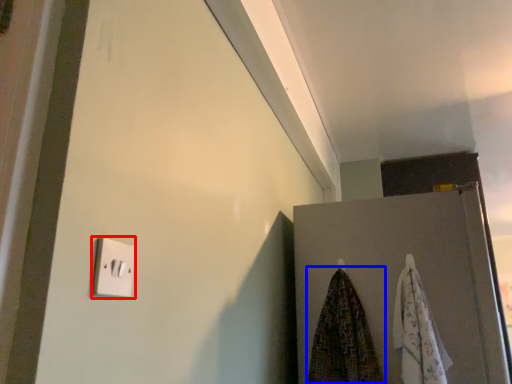
Question: Which of the following is the closest to the observer, light switch (highlighted by a red box) or beach towel (highlighted by a blue box)?

Choices:
 (A) light switch
 (B) beach towel

Answer: (A)